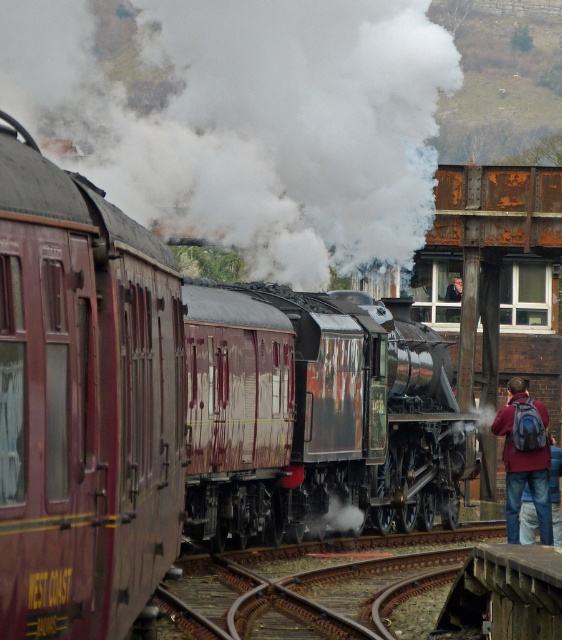
You are a photographer standing at the railway station. You want to take a photo of the maroon polished wood train at center and the denim jacket at lower right. Considering their heights, which object should you focus on first to ensure both are in frame without adjusting your camera angle?

The maroon polished wood train at center is much taller than the denim jacket at lower right, so you should focus on the maroon polished wood train at center first to ensure it fits within the frame.

You are a photographer standing at the railway station. You want to take a photo of the maroon polished wood train at center and the blue backpack at lower right. Which object is wider so that it can fit better in the frame?

The maroon polished wood train at center is wider than the blue backpack at lower right, so it will fit better in the frame.

Looking at this image, you are standing at the center of the railway station and see the maroon polished wood passenger train at left. If you want to board this train, which direction should you walk towards?

You should walk towards the left to reach the maroon polished wood passenger train at left since it is located at point (83, 403), which is to the left side of the station.